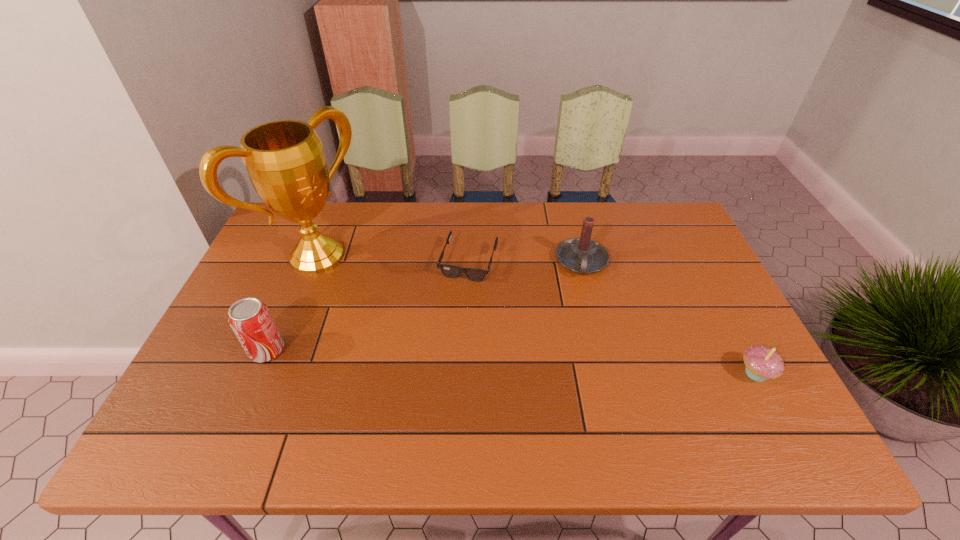
The image size is (960, 540). In order to click on unoccupied position between the third object from right to left and the second object from right to left in this screenshot , I will do `click(525, 261)`.

Choose which object is the fourth nearest neighbor to the award. Please provide its 2D coordinates. Your answer should be formatted as a tuple, i.e. [(x, y)], where the tuple contains the x and y coordinates of a point satisfying the conditions above.

[(762, 363)]

Identify which object is located as the second nearest to the rightmost object. Please provide its 2D coordinates. Your answer should be formatted as a tuple, i.e. [(x, y)], where the tuple contains the x and y coordinates of a point satisfying the conditions above.

[(450, 271)]

The width and height of the screenshot is (960, 540). I want to click on vacant space that satisfies the following two spatial constraints: 1. on the back side of the shortest object; 2. on the left side of the soda can, so click(305, 261).

I want to click on vacant space that satisfies the following two spatial constraints: 1. on the front side of the rightmost object; 2. on the left side of the sunglasses, so click(466, 373).